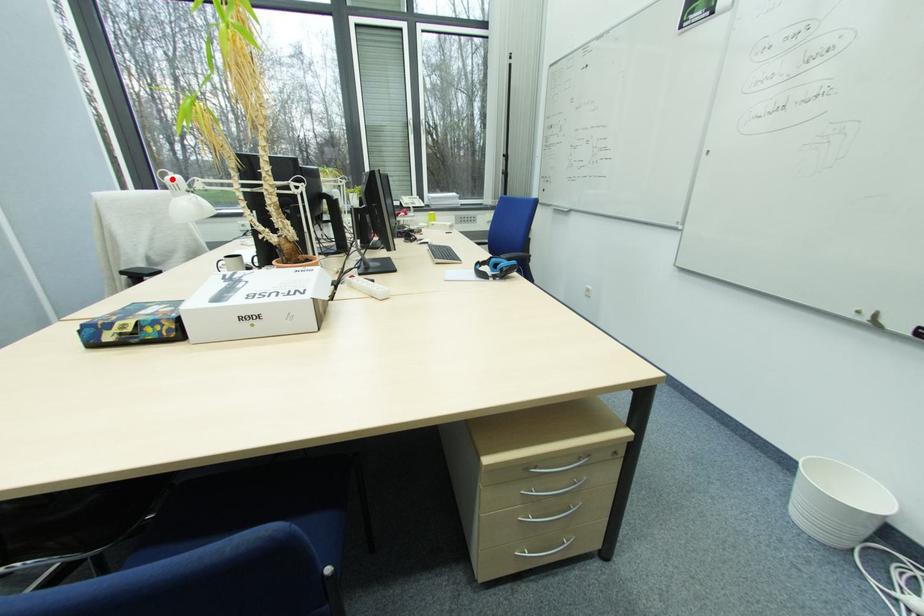
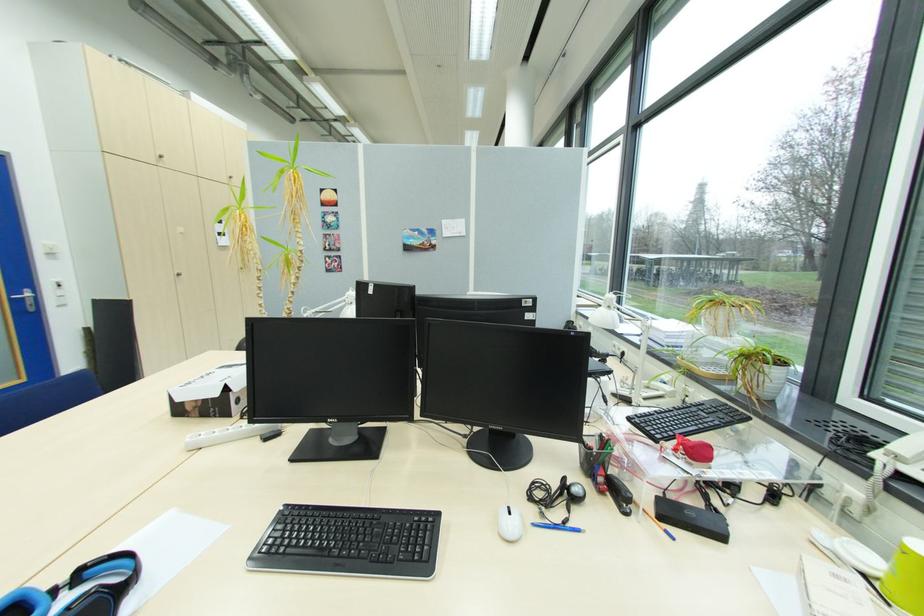
Question: I am providing you with two images of the same scene from different viewpoints. A red point is marked on the first image. Is the red point's position out of view in image 2?

Choices:
 (A) Yes
 (B) No

Answer: (A)